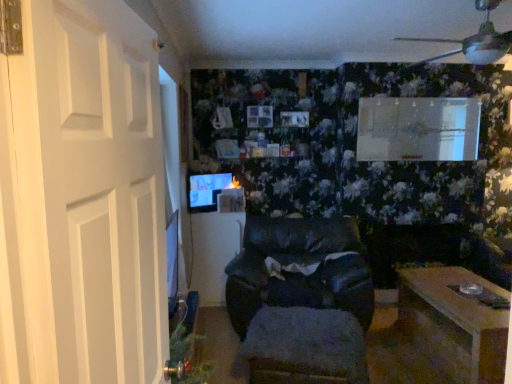
What are the coordinates of `free space above wooden table at lower right, which ranks as the second table in back-to-front order (from a real-world perspective)` in the screenshot? It's located at (469, 291).